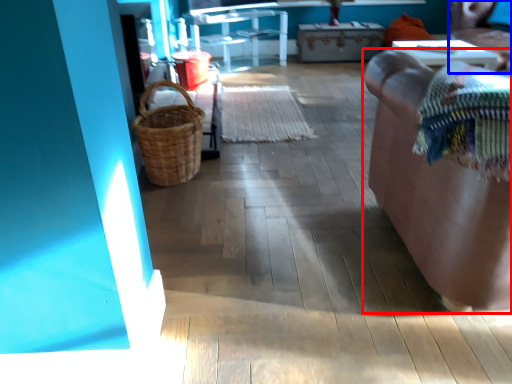
Question: Which object is closer to the camera taking this photo, furniture (highlighted by a red box) or chair (highlighted by a blue box)?

Choices:
 (A) furniture
 (B) chair

Answer: (A)